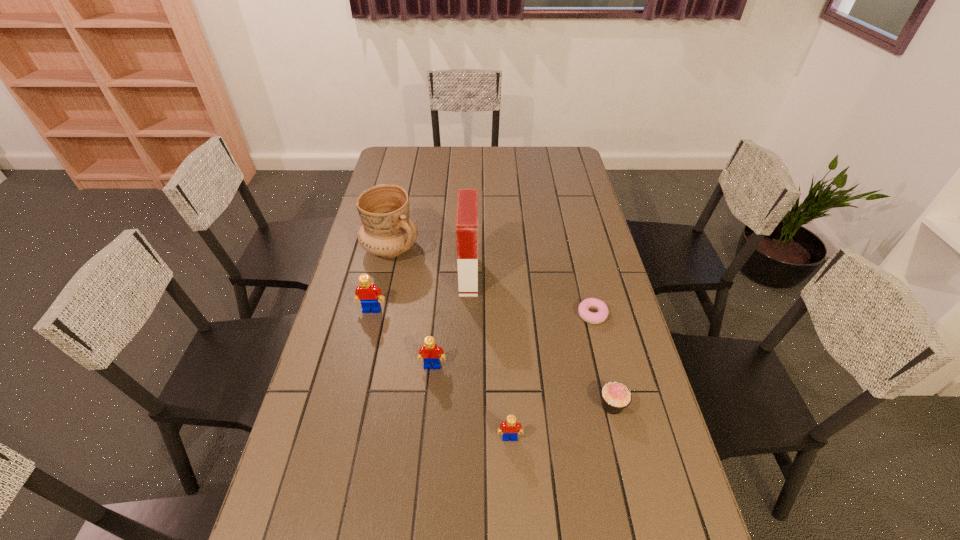
Identify the location of pastry that is at the right edge. (590, 303).

You are a GUI agent. You are given a task and a screenshot of the screen. Output one action in this format:
    pyautogui.click(x=<x>, y=<y>)
    Task: Click on the cupcake at the right edge
    The width and height of the screenshot is (960, 540).
    Given the screenshot: What is the action you would take?
    pyautogui.click(x=615, y=396)

The width and height of the screenshot is (960, 540). I want to click on free region at the left edge of the desktop, so point(375,181).

What are the coordinates of `vacant space at the right edge of the desktop` in the screenshot? It's located at (585, 198).

The width and height of the screenshot is (960, 540). I want to click on free point at the far right corner, so click(x=575, y=152).

Where is `free point between the cigarette_case and the nearest Lego`? free point between the cigarette_case and the nearest Lego is located at coordinates (490, 357).

You are a GUI agent. You are given a task and a screenshot of the screen. Output one action in this format:
    pyautogui.click(x=<x>, y=<y>)
    Task: Click on the vacant area between the second shortest Lego and the second nearest object
    
    Given the screenshot: What is the action you would take?
    pyautogui.click(x=522, y=386)

The width and height of the screenshot is (960, 540). Identify the location of free point between the pastry and the fourth object from left to right. (531, 295).

This screenshot has width=960, height=540. What are the coordinates of `free space between the cupcake and the second Lego from right to left` in the screenshot? It's located at (522, 386).

The height and width of the screenshot is (540, 960). I want to click on free space between the second Lego from left to right and the leftmost Lego, so click(x=402, y=338).